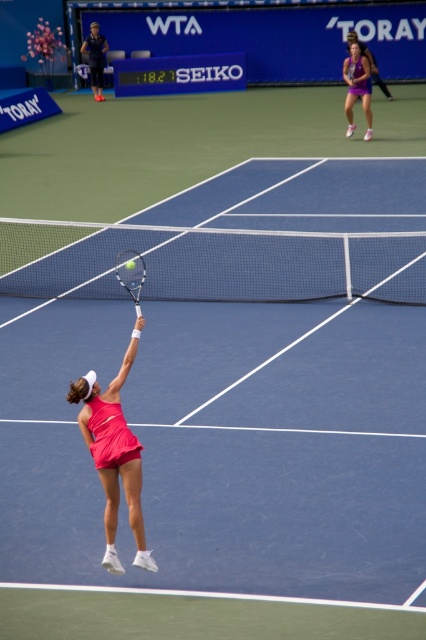
You are a photographer at the tennis match. You want to capture a photo that includes both the pink fabric tennis outfit at center and the purple fabric tennis outfit at upper right. Based on their sizes in the image, which outfit should you focus on first to ensure both are in frame?

The pink fabric tennis outfit at center occupies less space than the purple fabric tennis outfit at upper right, so you should focus on the purple fabric tennis outfit at upper right first to ensure both are in frame since it takes up more space and might require more attention to composition.

You are a tennis coach analyzing the players in the image. The purple fabric tennis outfit at upper right belongs to a player, and the silver metallic tennis racket at center is being used by another player. Which object takes up more space in the image?

The purple fabric tennis outfit at upper right has a larger size compared to the silver metallic tennis racket at center, so the purple fabric tennis outfit at upper right takes up more space in the image.

You are a tennis ball that just bounced on the court and need to reach the pink fabric tennis outfit at center. According to the court coordinates, where should you aim to hit the ball?

The pink fabric tennis outfit at center is located at coordinates point (114, 452), so you should aim for that point to reach it.